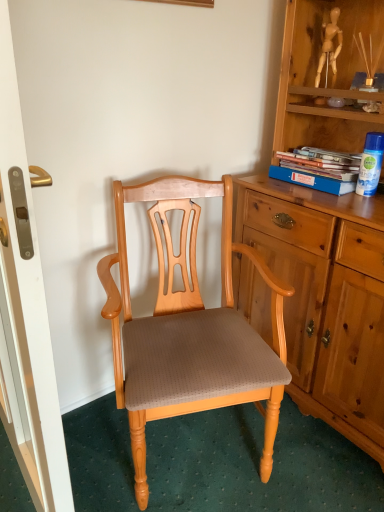
Question: From their relative heights in the image, would you say blue cardboard book at upper right is taller or shorter than matte wood screen door at left?

Choices:
 (A) tall
 (B) short

Answer: (B)

Question: Considering the positions of blue cardboard book at upper right and matte wood screen door at left in the image, is blue cardboard book at upper right wider or thinner than matte wood screen door at left?

Choices:
 (A) thin
 (B) wide

Answer: (B)

Question: Estimate the real-world distances between objects in this image. Which object is farther from the matte wood screen door at left?

Choices:
 (A) light brown wood chair at center
 (B) blue cardboard book at upper right
 (C) blue plastic spray can at upper right

Answer: (C)

Question: Based on their relative distances, which object is farther from the light brown wood chair at center?

Choices:
 (A) matte wood screen door at left
 (B) blue plastic spray can at upper right
 (C) blue cardboard book at upper right

Answer: (B)